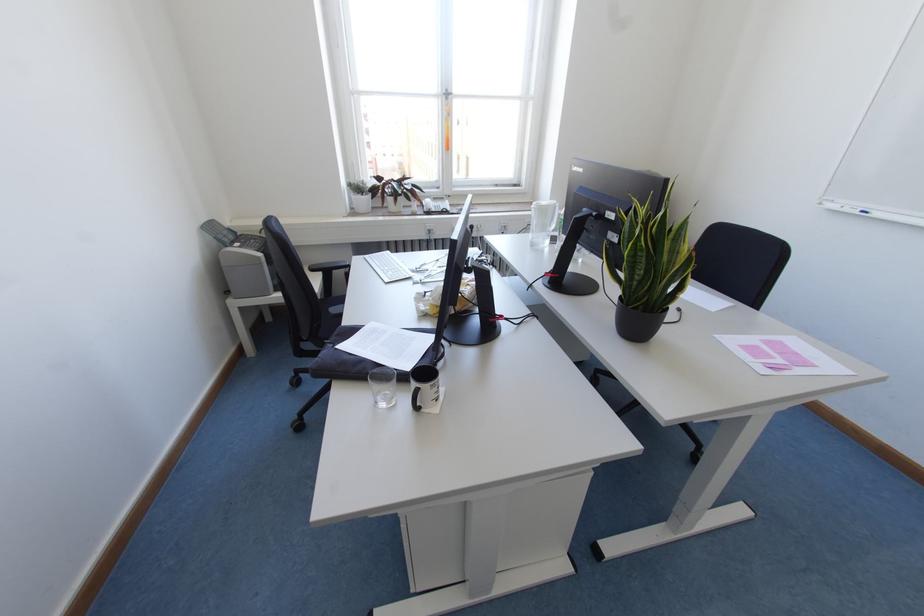
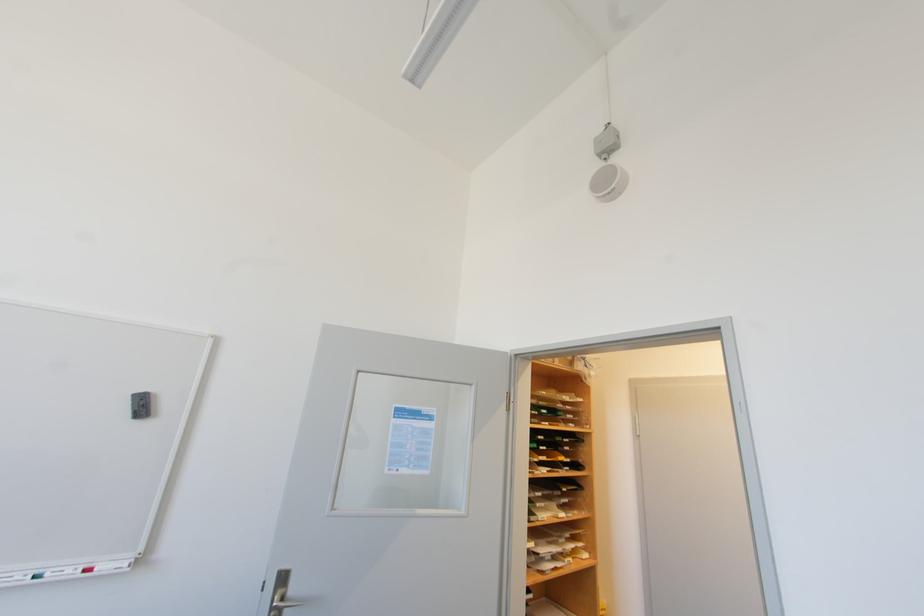
Question: How did the camera likely rotate?

Choices:
 (A) Left
 (B) Right
 (C) Up
 (D) Down

Answer: (B)